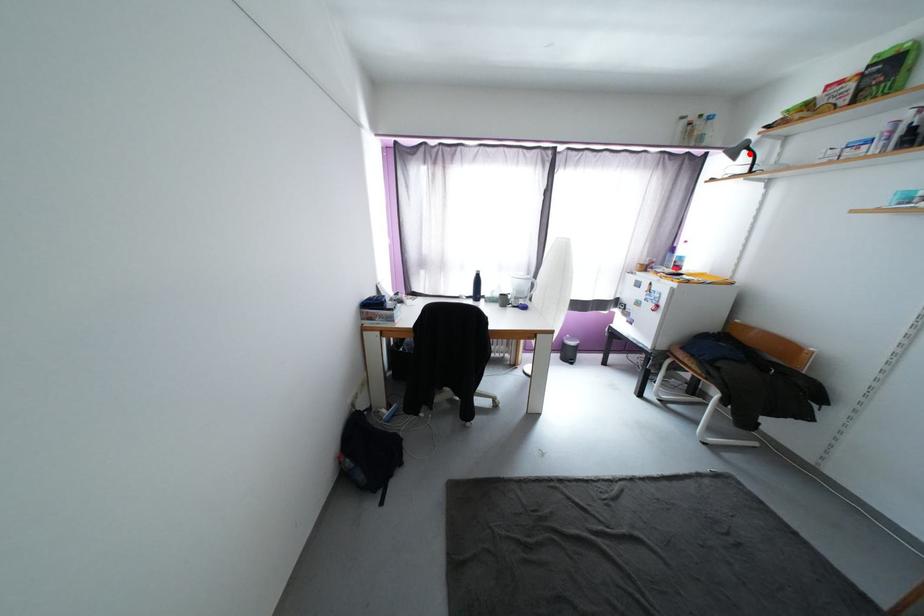
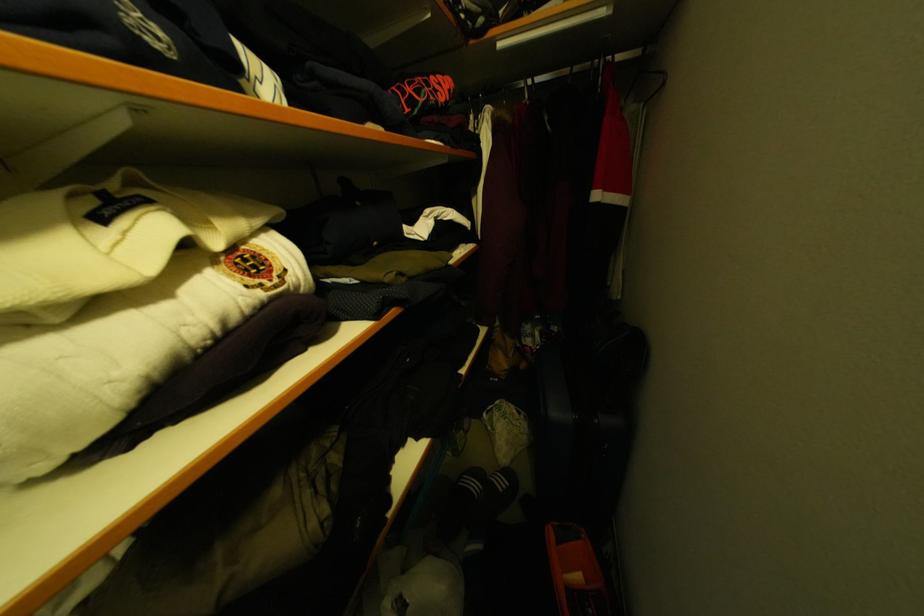
Question: I am providing you with two images of the same scene from different viewpoints. A red point is marked on the first image. Is the red point's position out of view in image 2?

Choices:
 (A) Yes
 (B) No

Answer: (A)